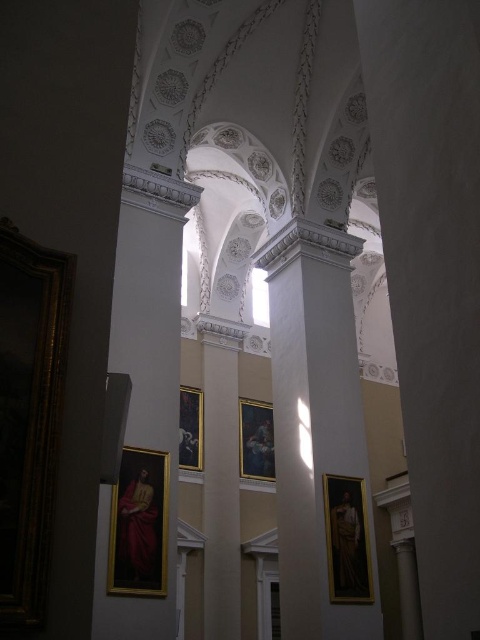
Question: Based on their relative distances, which object is farther from the black glossy picture frame at center?

Choices:
 (A) gold-framed portrait at center
 (B) white glossy column at center

Answer: (A)

Question: Is white glossy column at center smaller than matte gold picture frame at lower left?

Choices:
 (A) yes
 (B) no

Answer: (B)

Question: Which of the following is the closest to the observer?

Choices:
 (A) (303, 604)
 (B) (14, 355)
 (C) (252, 456)

Answer: (B)

Question: Is white glossy column at center below gold-framed portrait at center?

Choices:
 (A) yes
 (B) no

Answer: (B)

Question: Among these points, which one is nearest to the camera?

Choices:
 (A) (47, 356)
 (B) (188, 438)

Answer: (A)

Question: In this image, where is white glossy column at center located relative to gold-framed portrait at center?

Choices:
 (A) left
 (B) right

Answer: (A)